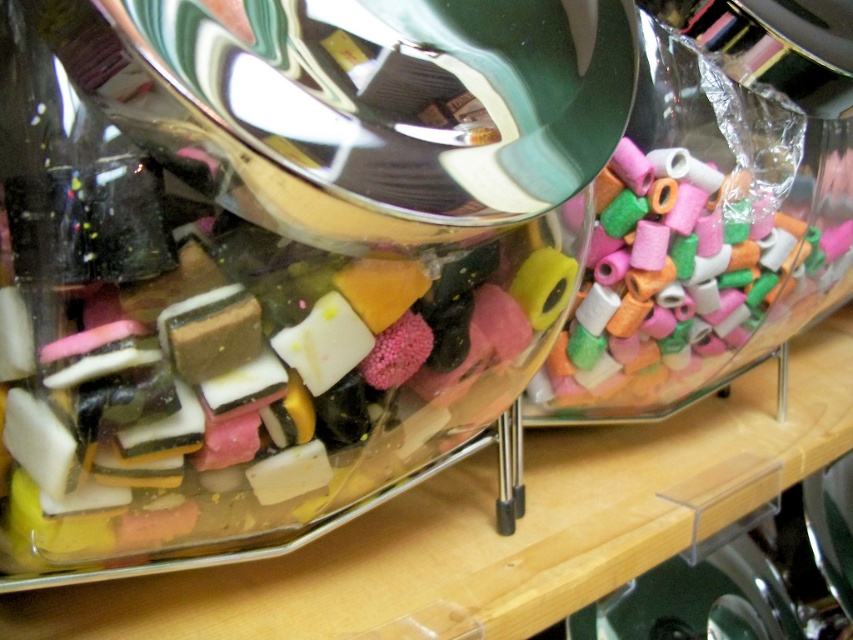
You are a customer at a candy store and want to buy both the translucent glass candy at center and the translucent plastic beads at right. If you look from the front of the store, which item is positioned more to the right?

The translucent plastic beads at right are positioned more to the right compared to the translucent glass candy at center.

You are a customer in a candy store holding a small gift box that is 10 inches long. You want to place both the translucent glass candy at center and the translucent plastic beads at right into the box without overlapping them. Is there enough space in the box to fit both items side by side?

The translucent glass candy at center and the translucent plastic beads at right are 12.30 inches apart from each other. Since the gift box is only 10 inches long, the combined length of the two items exceeds the box length. Therefore, they cannot fit side by side in the box.

You are a child holding a candy cane that is 25 centimeters long. You want to reach the translucent glass candy at center to grab a candy. Can you do so without moving your feet?

The distance between you and the translucent glass candy at center is 31.70 centimeters, which is longer than your candy cane of 25 centimeters. Therefore, you cannot reach it without moving your feet.